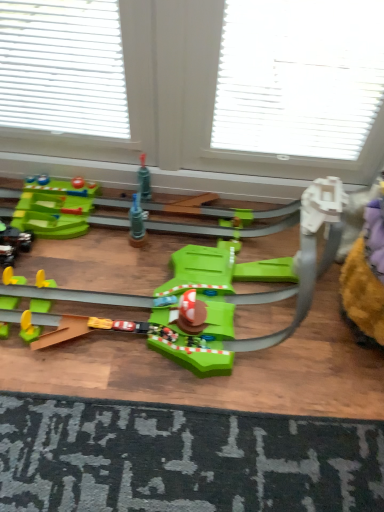
The width and height of the screenshot is (384, 512). I want to click on vacant space in dark gray textured doormat at bottom (from a real-world perspective), so click(x=195, y=458).